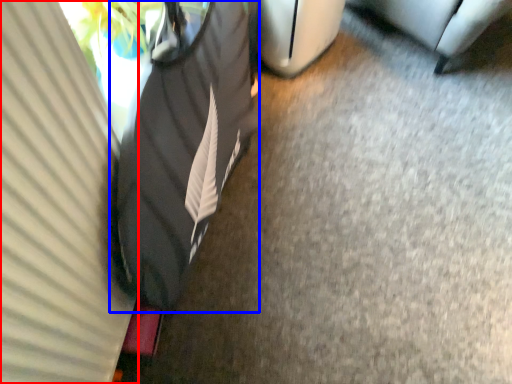
Question: Among these objects, which one is nearest to the camera, curtain (highlighted by a red box) or bean bag chair (highlighted by a blue box)?

Choices:
 (A) curtain
 (B) bean bag chair

Answer: (A)